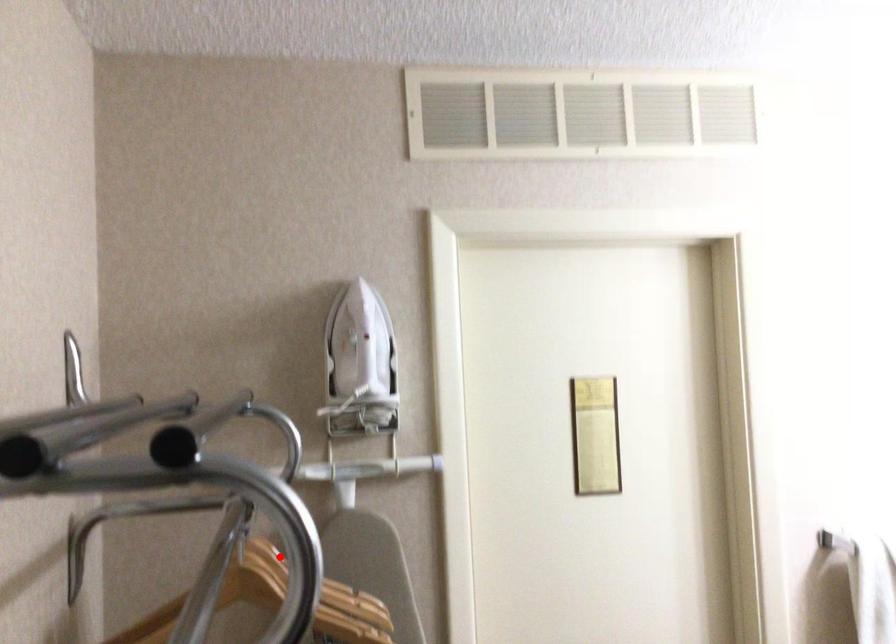
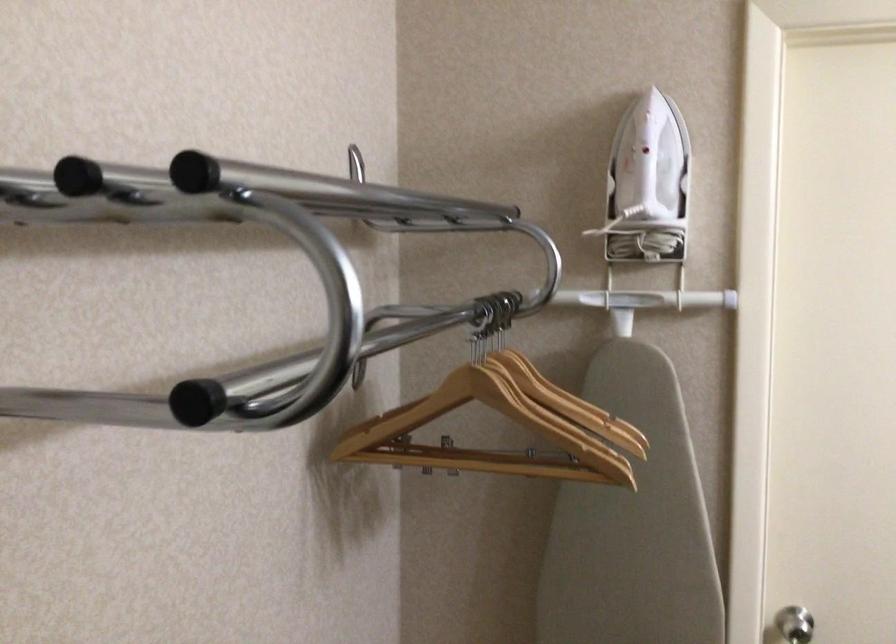
Question: A red point is marked in image1. In image2, is the corresponding 3D point closer to the camera or farther? Reply with the corresponding letter.

Choices:
 (A) The corresponding 3D point is closer.
 (B) The corresponding 3D point is farther.

Answer: (A)